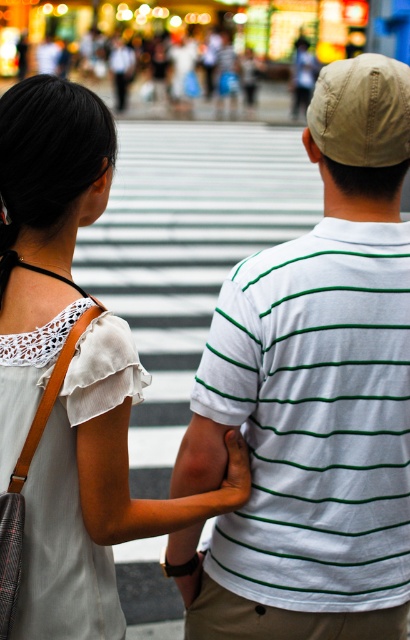
Is point (248, 360) positioned before point (43, 132)?

That is False.

Is the position of white striped shirt at center more distant than that of white lace blouse at upper left?

Yes, white striped shirt at center is behind white lace blouse at upper left.

Who is more distant from viewer, (359, 611) or (45, 550)?

Point (359, 611)

Locate an element on the screen. white striped shirt at center is located at coordinates (312, 396).

Is point (341, 378) farther from viewer compared to point (209, 515)?

No, it is not.

Is white striped shirt at center taller than orange smooth skin at lower center?

Yes.

What do you see at coordinates (312, 396) in the screenshot?
I see `white striped shirt at center` at bounding box center [312, 396].

What are the coordinates of `white striped shirt at center` in the screenshot? It's located at pos(312,396).

Is white lace blouse at upper left further to camera compared to orange smooth skin at lower center?

No, it is in front of orange smooth skin at lower center.

Does white lace blouse at upper left come in front of orange smooth skin at lower center?

Yes, it is.

Which is in front, point (72, 611) or point (241, 467)?

Positioned in front is point (72, 611).

This screenshot has width=410, height=640. What are the coordinates of `white lace blouse at upper left` in the screenshot? It's located at (65, 372).